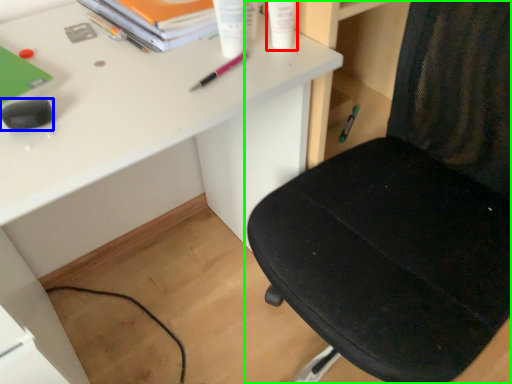
Question: Estimate the real-world distances between objects in this image. Which object is closer to stationery (highlighted by a red box), stationery (highlighted by a blue box) or chair (highlighted by a green box)?

Choices:
 (A) stationery
 (B) chair

Answer: (B)